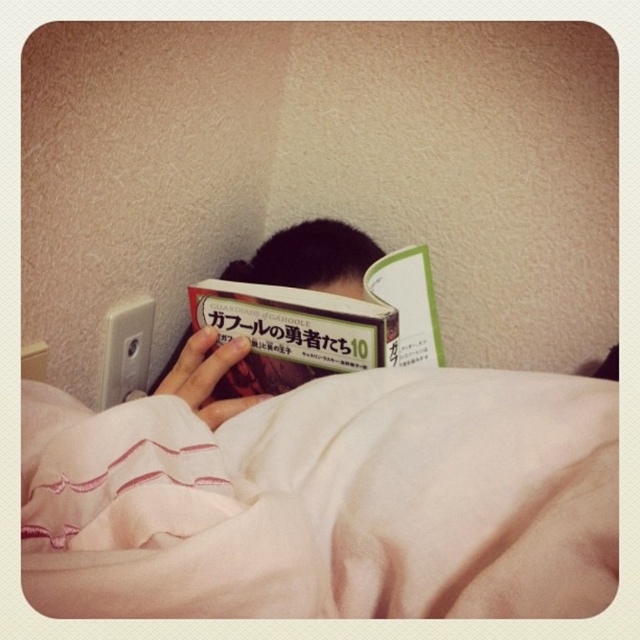
You are a person who wants to reach for a remote control placed on a table 10 inches away from you. You have a pink soft fabric blanket at lower center in your way. Can you reach the remote control without moving the blanket?

The pink soft fabric blanket at lower center is 9.85 inches away from the viewer. Since the remote control is 10 inches away, the blanket is closer to you than the remote control. Therefore, you cannot reach the remote control without moving the pink soft fabric blanket at lower center.

You are a delivery person who needs to place a new package on the surface where the pink soft fabric blanket at lower center and the hardcover book at center are located. Can you fit both items on the surface without overlapping them?

The pink soft fabric blanket at lower center is taller than the hardcover book at center, so there is enough space to place both items on the surface without overlapping them.

Consider the image. You are trying to decide whether to place a new decorative pillow on the pink soft fabric blanket at lower center or on the matte black book at center. Based on their sizes, which surface would be more stable for the pillow?

The pink soft fabric blanket at lower center is not as tall as the matte black book at center, so the matte black book at center is taller. However, the blanket is likely a larger and flatter surface, making it more stable for placing the pillow compared to the book.